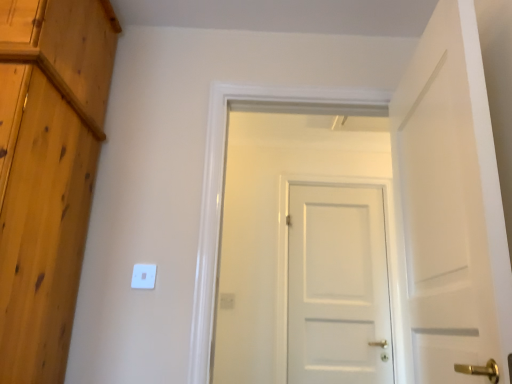
What do you see at coordinates (449, 208) in the screenshot? This screenshot has height=384, width=512. I see `white matte door at center, which is counted as the third door, starting from the back` at bounding box center [449, 208].

At what (x,y) coordinates should I click in order to perform the action: click on white matte door at center, positioned as the first door in back-to-front order. Please return your answer as a coordinate pair (x, y). This screenshot has height=384, width=512. Looking at the image, I should click on (337, 286).

You are a GUI agent. You are given a task and a screenshot of the screen. Output one action in this format:
    pyautogui.click(x=<x>, y=<y>)
    Task: Click on the white plastic electric outlet at center
    This screenshot has width=512, height=384.
    Given the screenshot: What is the action you would take?
    pyautogui.click(x=227, y=300)

The image size is (512, 384). Identify the location of white matte door at center, the 1th door when ordered from front to back. (449, 208).

Consider the image. Is white matte door at center, which is counted as the third door, starting from the back, positioned in front of white matte door at center, the second door in the front-to-back sequence?

Yes, white matte door at center, which is counted as the third door, starting from the back, is in front of white matte door at center, the second door in the front-to-back sequence.

Is white matte door at center, which is counted as the third door, starting from the back, aimed at white matte door at center, the 2th door viewed from the back?

Yes.

Looking at this image, who is taller, white matte door at center, the 1th door when ordered from front to back, or white matte door at center, the second door in the front-to-back sequence?

With more height is white matte door at center, the second door in the front-to-back sequence.

Which is more to the left, white matte door at center, which is counted as the third door, starting from the back, or white matte door at center, the 2th door viewed from the back?

white matte door at center, the 2th door viewed from the back, is more to the left.

Is point (267, 142) positioned behind point (441, 262)?

Yes, point (267, 142) is farther from viewer.

From a real-world perspective, is white matte door at center, the second door in the front-to-back sequence, positioned over white matte door at center, the 1th door when ordered from front to back, based on gravity?

Indeed, from a real-world perspective, white matte door at center, the second door in the front-to-back sequence, stands above white matte door at center, the 1th door when ordered from front to back.

Which object is wider, white matte door at center, the 2th door viewed from the back, or white matte door at center, which is counted as the third door, starting from the back?

With larger width is white matte door at center, the 2th door viewed from the back.

The image size is (512, 384). What are the coordinates of `the 1st door behind the white matte door at center, which is counted as the third door, starting from the back, starting your count from the anchor` in the screenshot? It's located at (305, 248).

Is the depth of white matte door at center, the 2th door viewed from the back, less than that of white plastic light switch at center?

Yes, it is in front of white plastic light switch at center.

Choose the correct answer: Is white matte door at center, the second door in the front-to-back sequence, inside white plastic light switch at center or outside it?

white matte door at center, the second door in the front-to-back sequence, is spatially situated outside white plastic light switch at center.

From their relative heights in the image, would you say white matte door at center, the second door in the front-to-back sequence, is taller or shorter than white plastic light switch at center?

white matte door at center, the second door in the front-to-back sequence, is taller than white plastic light switch at center.

From a real-world perspective, which is physically below, white matte door at center, the second door in the front-to-back sequence, or white plastic light switch at center?

From a 3D spatial view, white plastic light switch at center is below.

Can you confirm if white matte door at center, positioned as the first door in back-to-front order, is smaller than white matte door at center, the 2th door viewed from the back?

Yes.

Between point (365, 259) and point (279, 323), which one is positioned in front?

The point (279, 323) is closer.

From a real-world perspective, is white matte door at center, positioned as the first door in back-to-front order, physically above white matte door at center, the second door in the front-to-back sequence?

No, from a real-world perspective, white matte door at center, positioned as the first door in back-to-front order, is not over white matte door at center, the second door in the front-to-back sequence

How distant is white matte door at center, arranged as the third door when viewed from the front, from white matte door at center, the second door in the front-to-back sequence?

4.00 inches.

Can you confirm if white matte door at center, the 2th door viewed from the back, is smaller than white plastic electric outlet at center?

Actually, white matte door at center, the 2th door viewed from the back, might be larger than white plastic electric outlet at center.

Which is more to the right, white matte door at center, the 2th door viewed from the back, or white plastic electric outlet at center?

white matte door at center, the 2th door viewed from the back, is more to the right.

Relative to white plastic electric outlet at center, is white matte door at center, the second door in the front-to-back sequence, in front or behind?

white matte door at center, the second door in the front-to-back sequence, is positioned closer to the viewer than white plastic electric outlet at center.

Is white matte door at center, the second door in the front-to-back sequence, oriented away from white plastic electric outlet at center?

Yes.

Is white matte door at center, which is counted as the third door, starting from the back, in front of or behind white plastic light switch at center in the image?

Visually, white matte door at center, which is counted as the third door, starting from the back, is located in front of white plastic light switch at center.

Does white matte door at center, the 1th door when ordered from front to back, have a smaller size compared to white plastic light switch at center?

Actually, white matte door at center, the 1th door when ordered from front to back, might be larger than white plastic light switch at center.

From the image's perspective, which is above, white matte door at center, the 1th door when ordered from front to back, or white plastic light switch at center?

white matte door at center, the 1th door when ordered from front to back, appears higher in the image.

From a real-world perspective, does white matte door at center, the 1th door when ordered from front to back, sit lower than white plastic light switch at center?

Actually, white matte door at center, the 1th door when ordered from front to back, is physically above white plastic light switch at center in the real world.

Looking at this image, would you say white plastic light switch at center is outside white plastic electric outlet at center?

white plastic light switch at center is positioned outside white plastic electric outlet at center.

From the image's perspective, is white plastic light switch at center positioned above or below white plastic electric outlet at center?

white plastic light switch at center is above white plastic electric outlet at center.

What are the coordinates of `light switch that appears on the left of white plastic electric outlet at center` in the screenshot? It's located at (143, 276).

From a real-world perspective, is white plastic light switch at center on top of white plastic electric outlet at center?

Yes.

Locate an element on the screen. The image size is (512, 384). door that is the 1st one when counting backward from the white matte door at center, the 1th door when ordered from front to back is located at coordinates (305, 248).

From the image's perspective, starting from the white matte door at center, the 1th door when ordered from front to back, which door is the 1st one below? Please provide its 2D coordinates.

[(305, 248)]

Estimate the real-world distances between objects in this image. Which object is further from white matte door at center, positioned as the first door in back-to-front order, white matte door at center, the second door in the front-to-back sequence, or white matte door at center, the 1th door when ordered from front to back?

white matte door at center, the 1th door when ordered from front to back, is further to white matte door at center, positioned as the first door in back-to-front order.

Based on their spatial positions, is white matte door at center, positioned as the first door in back-to-front order, or white matte door at center, which is counted as the third door, starting from the back, closer to white plastic light switch at center?

white matte door at center, which is counted as the third door, starting from the back, is positioned closer to the anchor white plastic light switch at center.

From the image, which object appears to be nearer to white plastic light switch at center, white matte door at center, the 2th door viewed from the back, or white matte door at center, positioned as the first door in back-to-front order?

white matte door at center, the 2th door viewed from the back, lies closer to white plastic light switch at center than the other object.

Looking at the image, which one is located closer to white plastic light switch at center, white matte door at center, which is counted as the third door, starting from the back, or white matte door at center, arranged as the third door when viewed from the front?

white matte door at center, which is counted as the third door, starting from the back, is positioned closer to the anchor white plastic light switch at center.

Which object lies nearer to the anchor point white matte door at center, positioned as the first door in back-to-front order, white matte door at center, the 2th door viewed from the back, or white plastic light switch at center?

white matte door at center, the 2th door viewed from the back, lies closer to white matte door at center, positioned as the first door in back-to-front order, than the other object.

Estimate the real-world distances between objects in this image. Which object is closer to white plastic light switch at center, white matte door at center, arranged as the third door when viewed from the front, or white plastic electric outlet at center?

Based on the image, white plastic electric outlet at center appears to be nearer to white plastic light switch at center.

Which object lies further to the anchor point white plastic electric outlet at center, white matte door at center, the 2th door viewed from the back, or white matte door at center, which is counted as the third door, starting from the back?

white matte door at center, which is counted as the third door, starting from the back, lies further to white plastic electric outlet at center than the other object.

Estimate the real-world distances between objects in this image. Which object is further from white matte door at center, the second door in the front-to-back sequence, white matte door at center, arranged as the third door when viewed from the front, or white plastic light switch at center?

white plastic light switch at center.

In order to click on door between white plastic light switch at center and white plastic electric outlet at center from front to back in this screenshot , I will do `click(337, 286)`.

You are a GUI agent. You are given a task and a screenshot of the screen. Output one action in this format:
    pyautogui.click(x=<x>, y=<y>)
    Task: Click on the light switch positioned between white matte door at center, the 1th door when ordered from front to back, and white matte door at center, positioned as the first door in back-to-front order, from near to far
    The width and height of the screenshot is (512, 384).
    Given the screenshot: What is the action you would take?
    pyautogui.click(x=143, y=276)

I want to click on door between white matte door at center, which is counted as the third door, starting from the back, and white matte door at center, arranged as the third door when viewed from the front, in the front-back direction, so (305, 248).

Image resolution: width=512 pixels, height=384 pixels. In order to click on light switch positioned between white matte door at center, the 2th door viewed from the back, and white plastic electric outlet at center from near to far in this screenshot , I will do `click(143, 276)`.